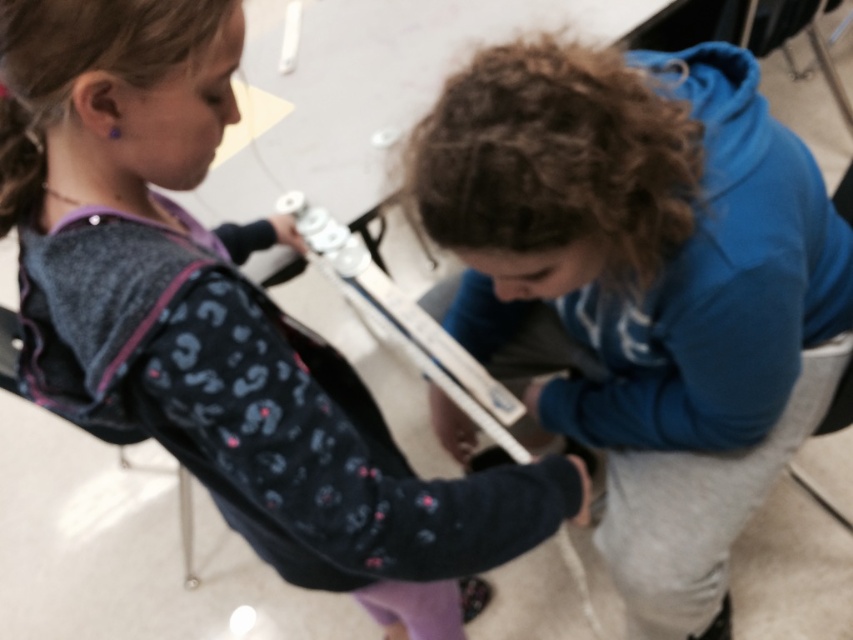
Question: Can you confirm if blue fleece hoodie at center is bigger than matte black hoodie at center?

Choices:
 (A) yes
 (B) no

Answer: (B)

Question: Does blue fleece hoodie at center appear on the left side of matte black hoodie at center?

Choices:
 (A) no
 (B) yes

Answer: (A)

Question: Is blue fleece hoodie at center closer to the viewer compared to matte black hoodie at center?

Choices:
 (A) yes
 (B) no

Answer: (B)